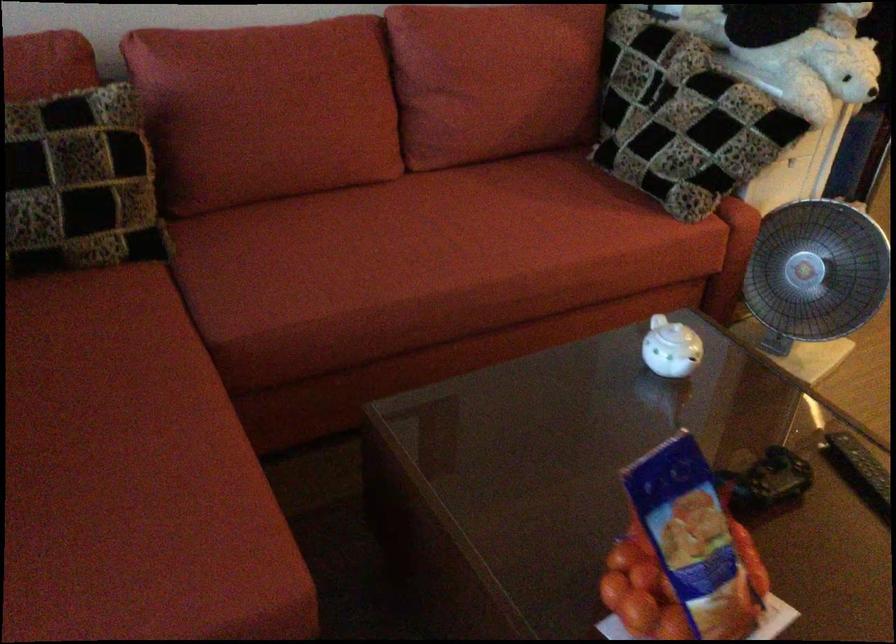
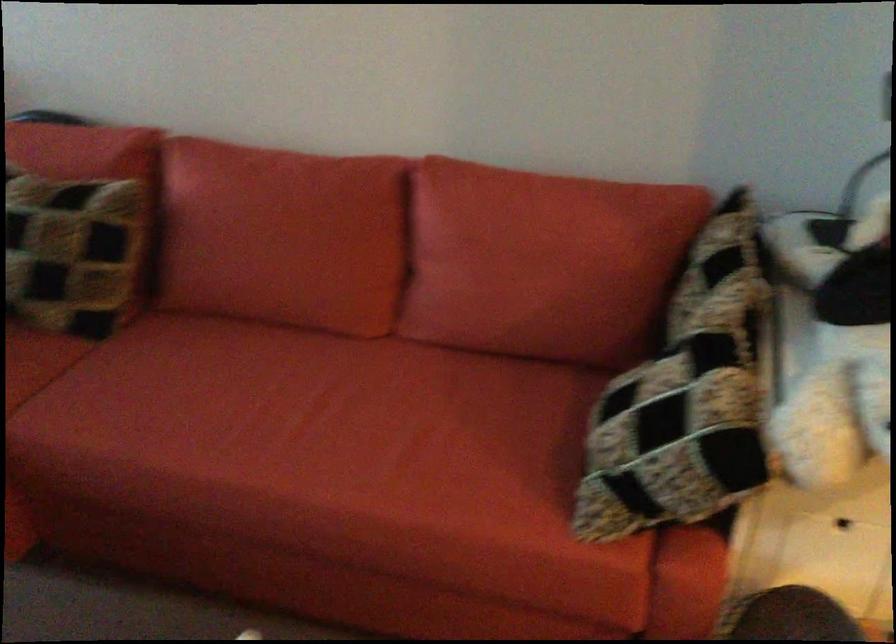
The point at (x=524, y=77) is marked in the first image. Where is the corresponding point in the second image?

(538, 270)